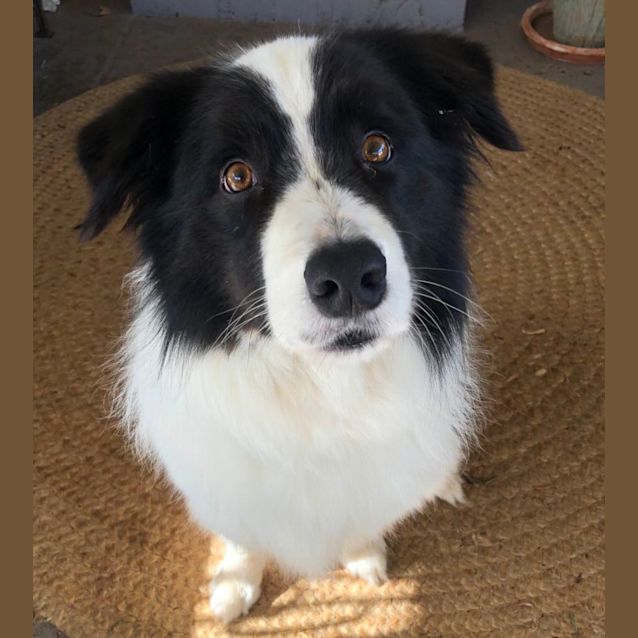
Image resolution: width=638 pixels, height=638 pixels. Identify the location of wood floor. (85, 64).